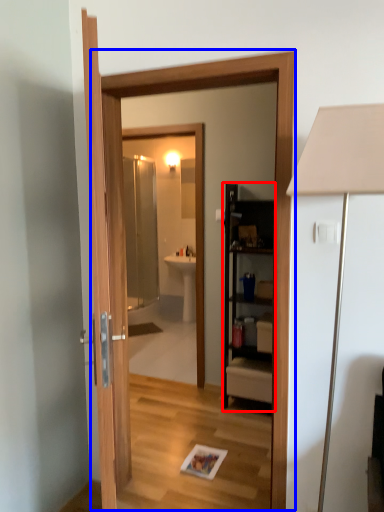
Question: Which object appears farthest to the camera in this image, cabinetry (highlighted by a red box) or screen door (highlighted by a blue box)?

Choices:
 (A) cabinetry
 (B) screen door

Answer: (A)